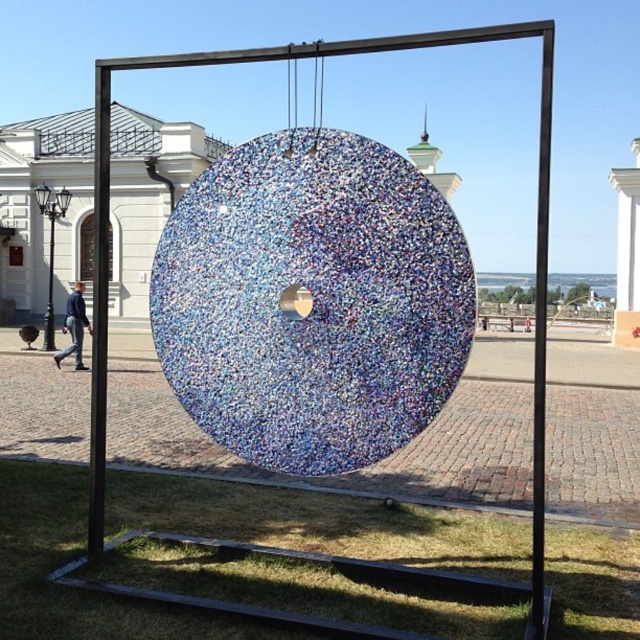
Between translucent mosaic circle at center and blue denim jacket at lower left, which one appears on the left side from the viewer's perspective?

blue denim jacket at lower left is more to the left.

Is translucent mosaic circle at center shorter than blue denim jacket at lower left?

Incorrect, translucent mosaic circle at center's height does not fall short of blue denim jacket at lower left's.

Measure the distance between translucent mosaic circle at center and camera.

translucent mosaic circle at center and camera are 4.40 meters apart from each other.

Locate an element on the screen. translucent mosaic circle at center is located at coordinates (312, 301).

Based on the photo, who is positioned more to the left, black metal pole at left or blue denim jacket at lower left?

From the viewer's perspective, blue denim jacket at lower left appears more on the left side.

The image size is (640, 640). I want to click on black metal pole at left, so click(99, 308).

Who is positioned more to the left, translucent mosaic circle at center or black metal pole at left?

Positioned to the left is black metal pole at left.

Which is behind, point (252, 428) or point (108, 102)?

Point (108, 102)

Who is more forward, (296, 212) or (97, 340)?

Point (296, 212)

The height and width of the screenshot is (640, 640). I want to click on translucent mosaic circle at center, so click(312, 301).